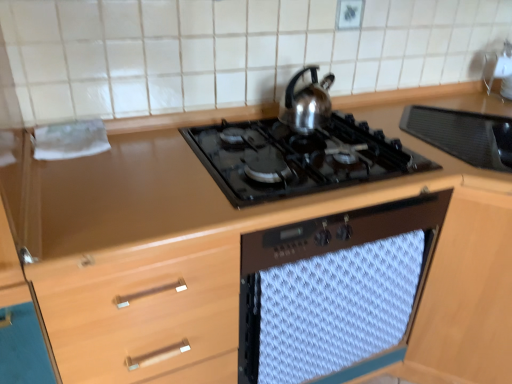
Identify the location of free location in front of satin silver kettle at upper center. Image resolution: width=512 pixels, height=384 pixels. (301, 168).